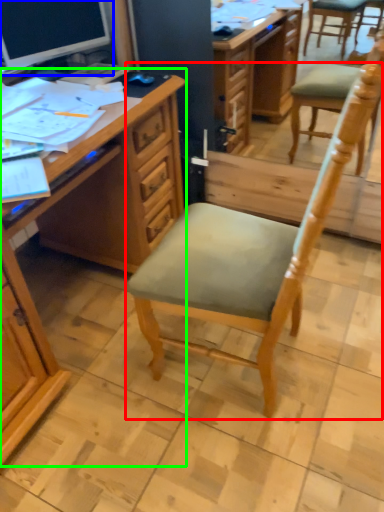
Question: Which object is positioned closest to chair (highlighted by a red box)? Select from computer monitor (highlighted by a blue box) and desk (highlighted by a green box).

Choices:
 (A) computer monitor
 (B) desk

Answer: (B)